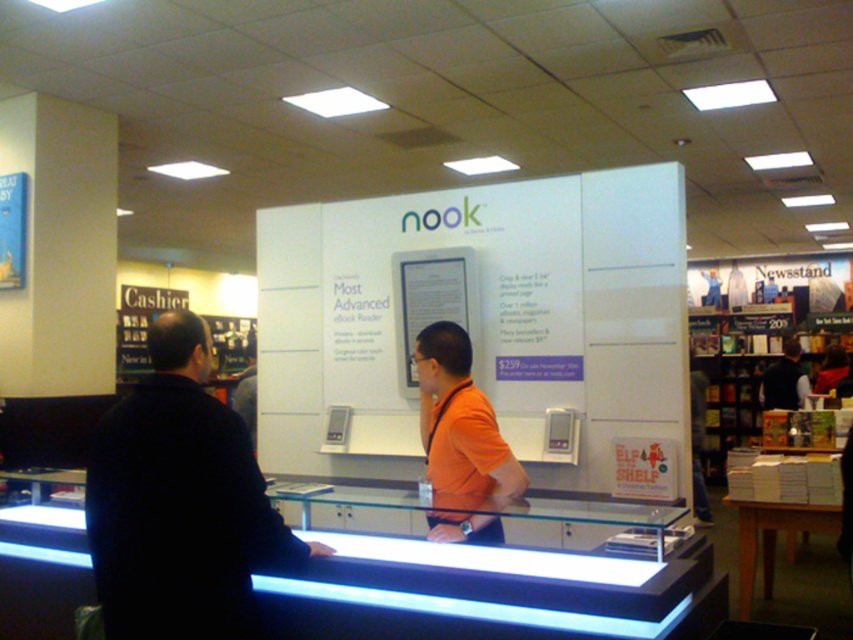
Question: Can you confirm if transparent glass counter at center is positioned below dark blue jacket at left?

Choices:
 (A) yes
 (B) no

Answer: (A)

Question: Which of the following is the farthest from the observer?

Choices:
 (A) (198, 496)
 (B) (479, 413)

Answer: (B)

Question: Can you confirm if transparent glass counter at center is bigger than dark blue jacket at left?

Choices:
 (A) yes
 (B) no

Answer: (A)

Question: Which object appears farthest from the camera in this image?

Choices:
 (A) dark blue vest at center
 (B) dark blue jacket at left
 (C) orange fabric shirt at center
 (D) transparent glass counter at center

Answer: (A)

Question: Is dark blue jacket at left wider than dark blue vest at center?

Choices:
 (A) no
 (B) yes

Answer: (B)

Question: Which of these objects is positioned closest to the dark blue jacket at left?

Choices:
 (A) transparent glass counter at center
 (B) orange fabric shirt at center

Answer: (A)